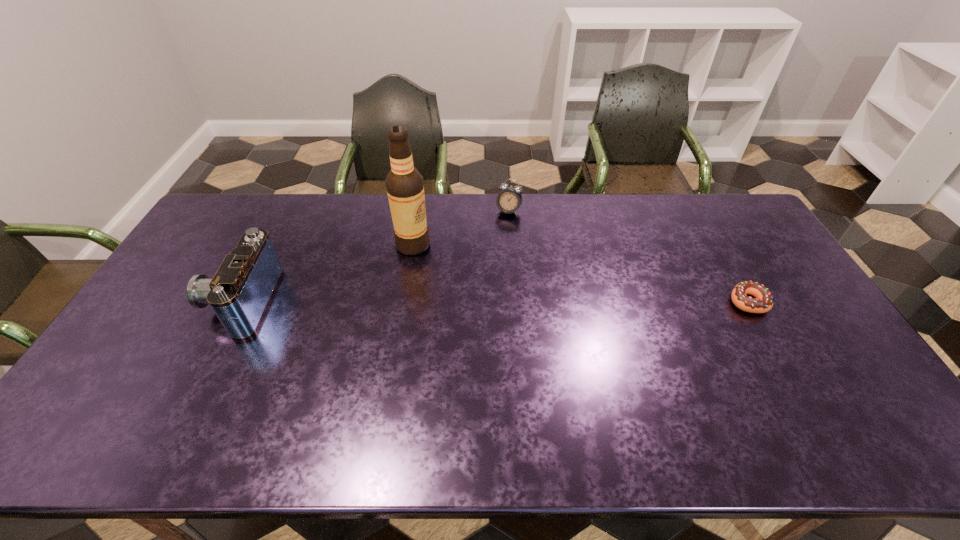
You are a GUI agent. You are given a task and a screenshot of the screen. Output one action in this format:
    pyautogui.click(x=<x>, y=<y>)
    Task: Click on the blank area located on the face of the farthest object
    
    Given the screenshot: What is the action you would take?
    pyautogui.click(x=495, y=238)

The image size is (960, 540). What are the coordinates of `vacant region located 0.310m on the face of the farthest object` in the screenshot? It's located at tap(479, 274).

Identify the location of free space located 0.180m on the label of the second farthest object. (456, 284).

Locate an element on the screen. This screenshot has height=540, width=960. free space located 0.290m on the label of the second farthest object is located at coordinates (479, 304).

Identify the location of free space located on the label of the second farthest object. This screenshot has width=960, height=540. (434, 264).

Identify the location of object at the far edge. (509, 200).

Find the location of `object that is at the right edge`. object that is at the right edge is located at coordinates (763, 301).

This screenshot has height=540, width=960. In the image, there is a desktop. What are the coordinates of `free region at the far edge` in the screenshot? It's located at (518, 226).

Locate an element on the screen. vacant point at the near edge is located at coordinates (199, 379).

Identify the location of free location at the left edge of the desktop. The image size is (960, 540). tap(194, 242).